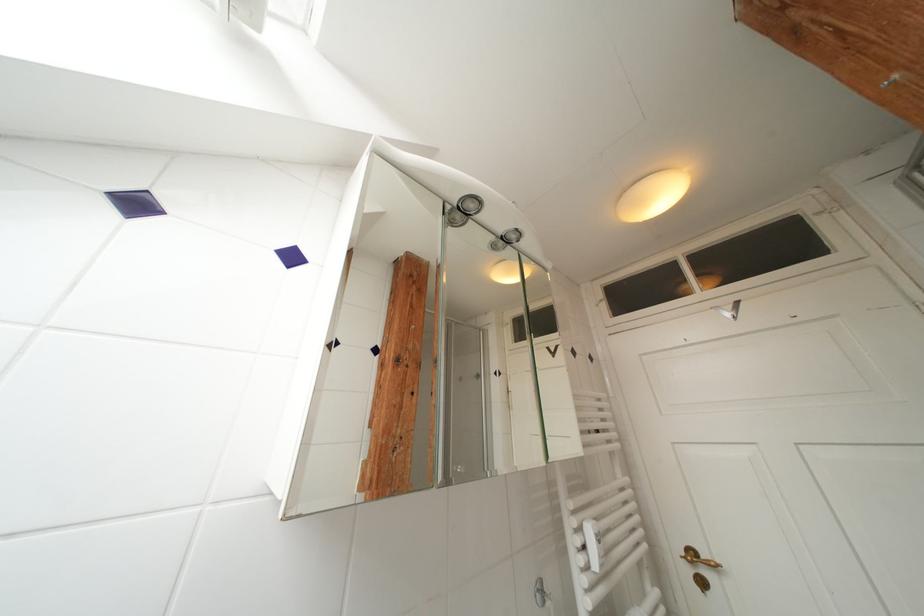
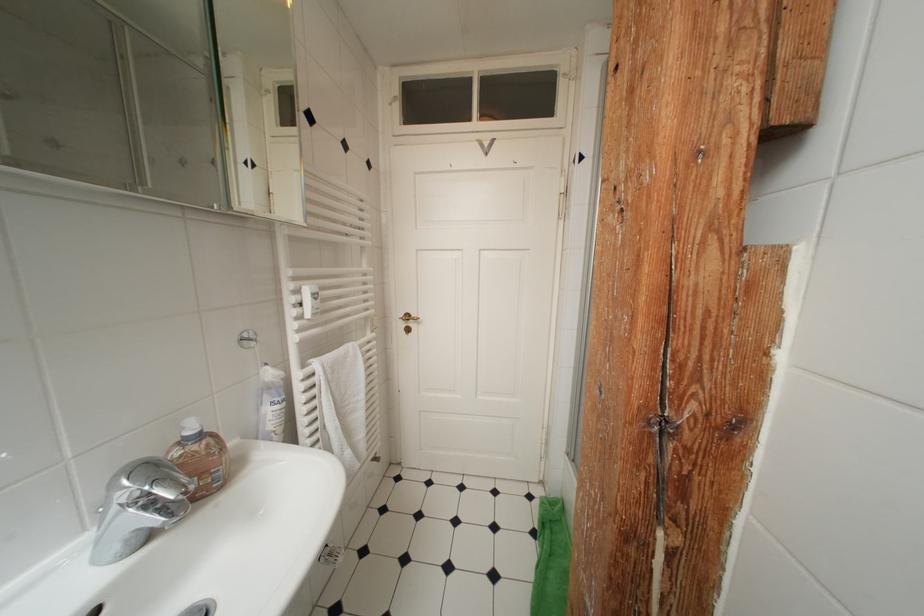
The first image is from the beginning of the video and the second image is from the end. How did the camera likely rotate when shooting the video?

The rotation direction of the camera is right-down.